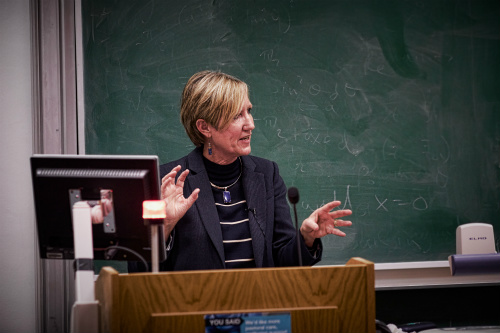
Image resolution: width=500 pixels, height=333 pixels. I want to click on dusty white chalkboard, so click(398, 110), click(473, 139), click(133, 95), click(187, 22).